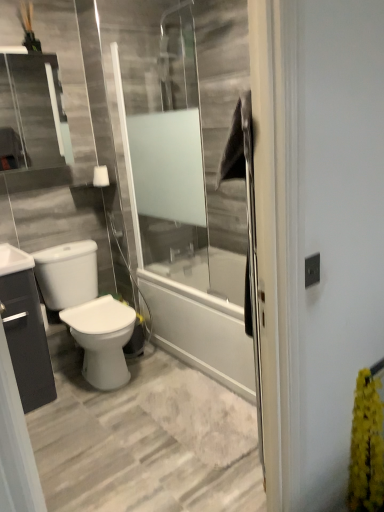
Find the location of `free space that is in between white glossy toilet at lower left and matte black cabinet at left`. free space that is in between white glossy toilet at lower left and matte black cabinet at left is located at coordinates (60, 396).